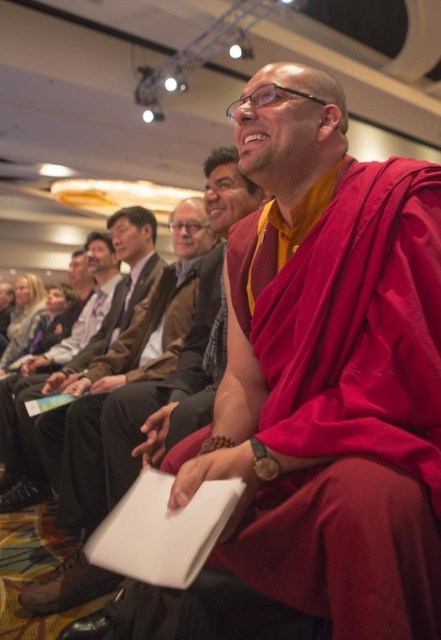
Between maroon silk robe at center and brown leather jacket at center, which one has less height?

brown leather jacket at center is shorter.

From the picture: Who is positioned more to the left, maroon silk robe at center or brown leather jacket at center?

brown leather jacket at center

Does point (242, 189) come in front of point (115, 296)?

That is True.

Identify the location of maroon silk robe at center. (171, 371).